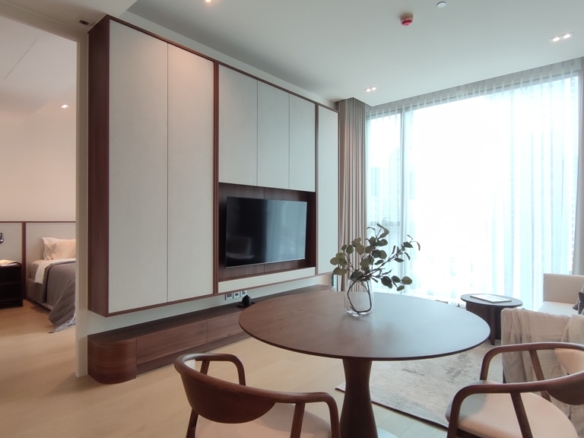
Identify the location of ceiling. (371, 25).